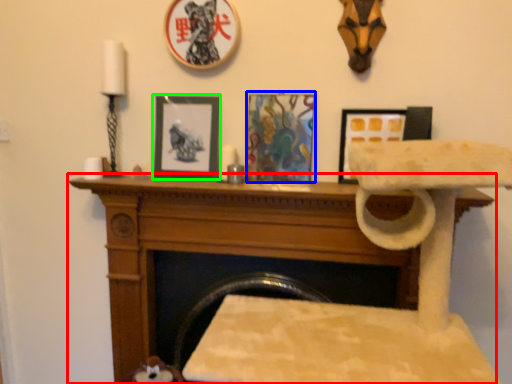
Question: Based on their relative distances, which object is farther from furniture (highlighted by a red box)? Choose from picture frame (highlighted by a blue box) and picture frame (highlighted by a green box).

Choices:
 (A) picture frame
 (B) picture frame

Answer: (B)